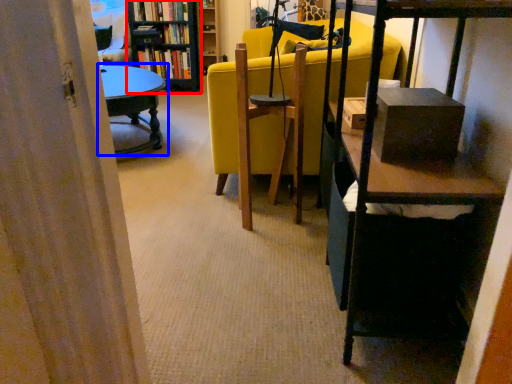
Question: Which object appears farthest to the camera in this image, bookcase (highlighted by a red box) or table (highlighted by a blue box)?

Choices:
 (A) bookcase
 (B) table

Answer: (A)